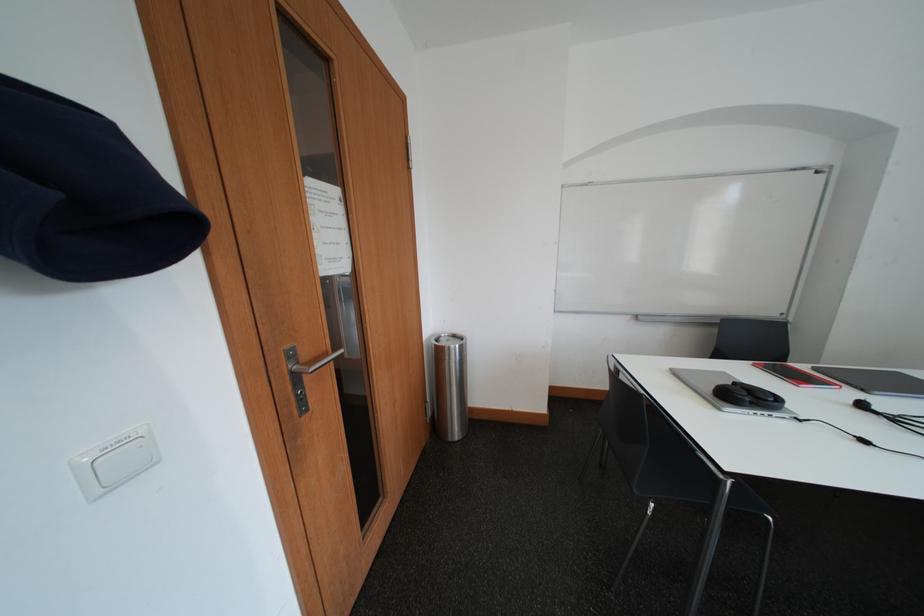
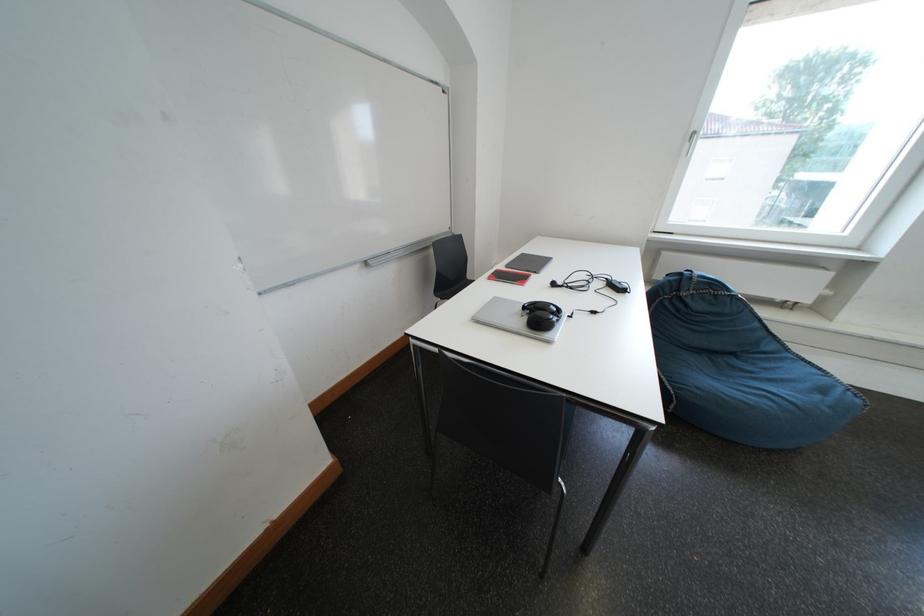
How did the camera likely rotate?

The camera rotated toward right-down.